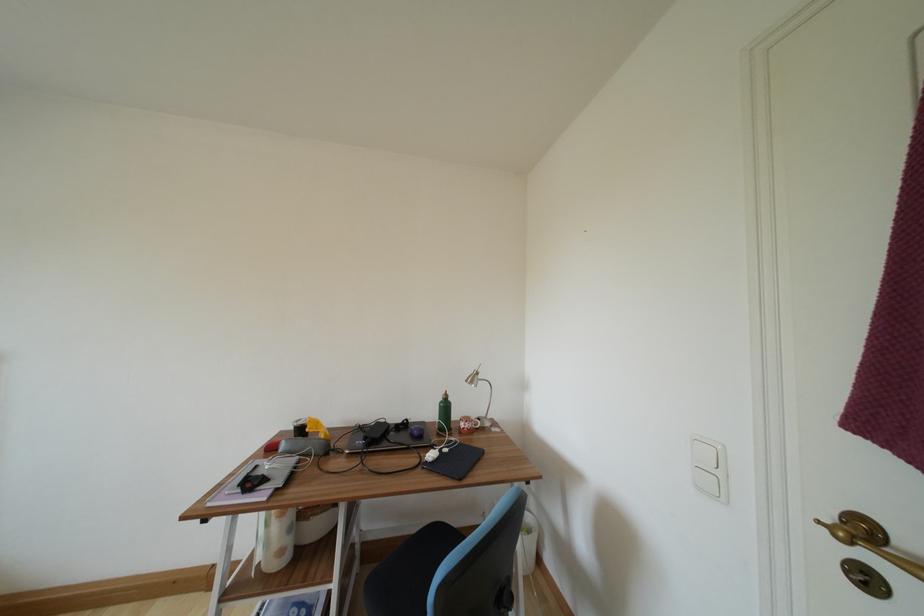
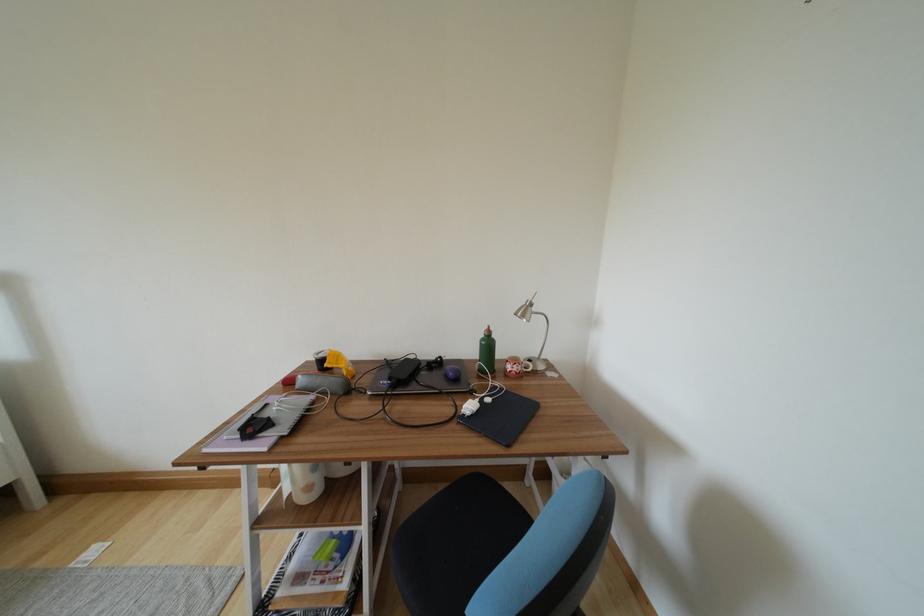
Find the pixel in the second image that matches [286,556] in the first image.

(313, 492)